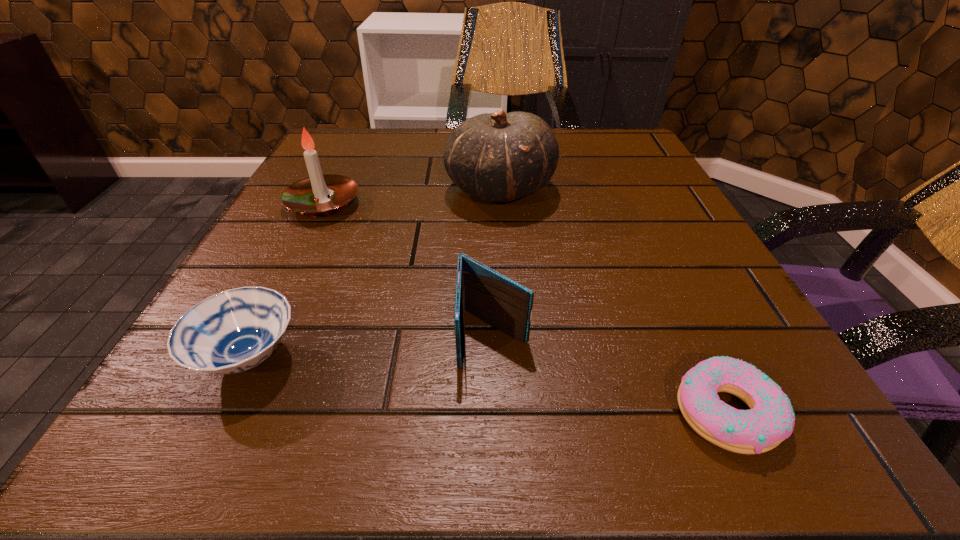
In order to click on gourd in this screenshot , I will do `click(497, 157)`.

The height and width of the screenshot is (540, 960). What are the coordinates of `candle` in the screenshot? It's located at (309, 196).

Where is `wallet`? wallet is located at coordinates (506, 305).

Identify the location of soup bowl. This screenshot has height=540, width=960. (233, 331).

This screenshot has height=540, width=960. I want to click on the rightmost object, so click(770, 420).

Locate an element on the screen. The width and height of the screenshot is (960, 540). doughnut is located at coordinates (770, 420).

This screenshot has width=960, height=540. Identify the location of free location located on the left of the gourd. (409, 190).

Locate an element on the screen. Image resolution: width=960 pixels, height=540 pixels. free region located on the back of the candle is located at coordinates [x=359, y=133].

This screenshot has width=960, height=540. Identify the location of vacant space situated 0.100m on the exterior surface of the wallet. (496, 452).

Locate an element on the screen. This screenshot has width=960, height=540. free region located on the back of the fourth tallest object is located at coordinates (296, 262).